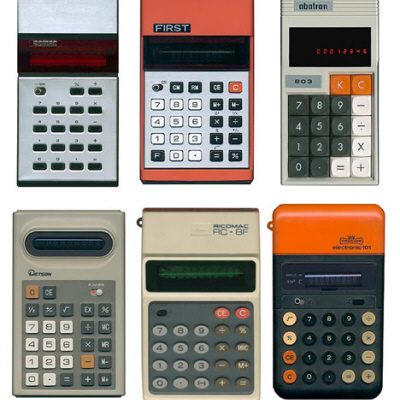
Image resolution: width=400 pixels, height=400 pixels. I want to click on screen, so click(335, 71).